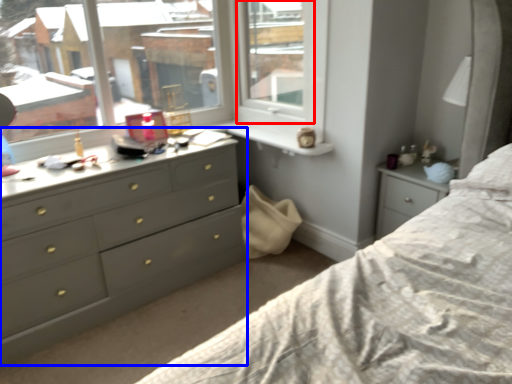
Question: Which point is closer to the camera, window frame (highlighted by a red box) or chest of drawers (highlighted by a blue box)?

Choices:
 (A) window frame
 (B) chest of drawers

Answer: (B)